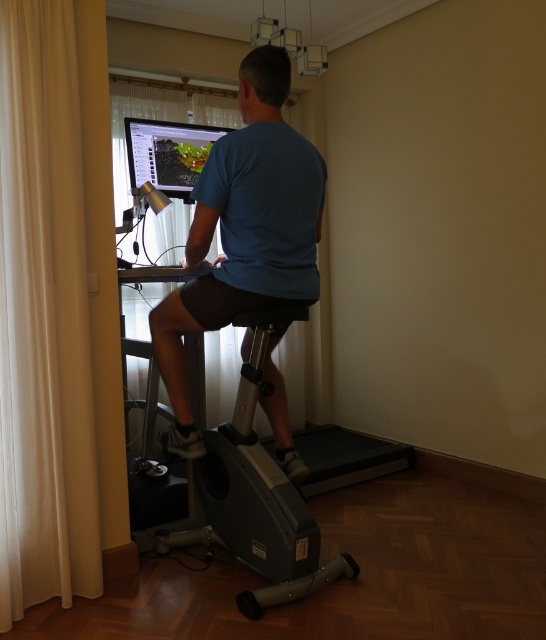
You are a delivery person who needs to place a small package on the desk in front of the exercise bike. However, there is a white fabric curtain at left in the room. Can you safely place the package on the desk without it falling off due to the curtain?

The white fabric curtain at left is located at point (44, 317), which is near the edge of the desk. Since the curtain is positioned at the edge, placing the package closer to the center of the desk would prevent it from falling off.

You are a delivery robot that needs to place a package between the white fabric curtain at left and the blue matte shirt at center. The package is 50 centimeters wide. Can you fit it in the space between them?

The distance between the white fabric curtain at left and the blue matte shirt at center is 47.42 centimeters. Since the package is 50 centimeters wide, it cannot fit in the space between them.

You are a delivery robot with a height of 1.5 meters. You need to deliver a package to the desk in front of the exercise bike. However, there is a white fabric curtain at left in the way. Can you pass under the curtain without touching it?

The distance between the white fabric curtain at left and the camera is 1.99 meters, which is taller than the robot height of 1.5 meters. Therefore, the robot can pass under the curtain without touching it.